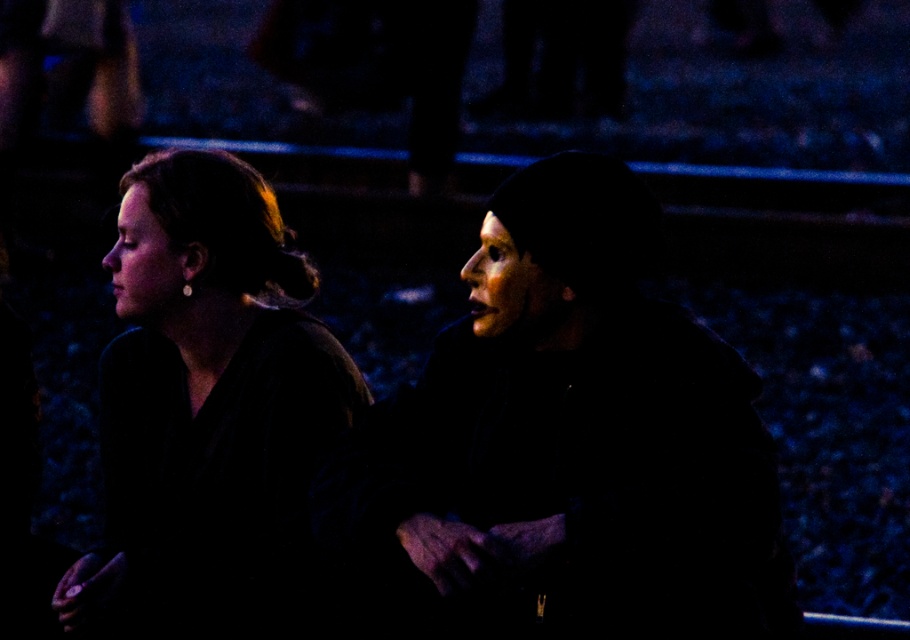
Question: Is black matte coat at center below matte brown coat at left?

Choices:
 (A) no
 (B) yes

Answer: (B)

Question: Which of the following is the closest to the observer?

Choices:
 (A) matte brown coat at left
 (B) black matte coat at center

Answer: (B)

Question: Does black matte coat at center appear over matte brown coat at left?

Choices:
 (A) yes
 (B) no

Answer: (B)

Question: Does black matte coat at center appear on the left side of matte brown coat at left?

Choices:
 (A) no
 (B) yes

Answer: (A)